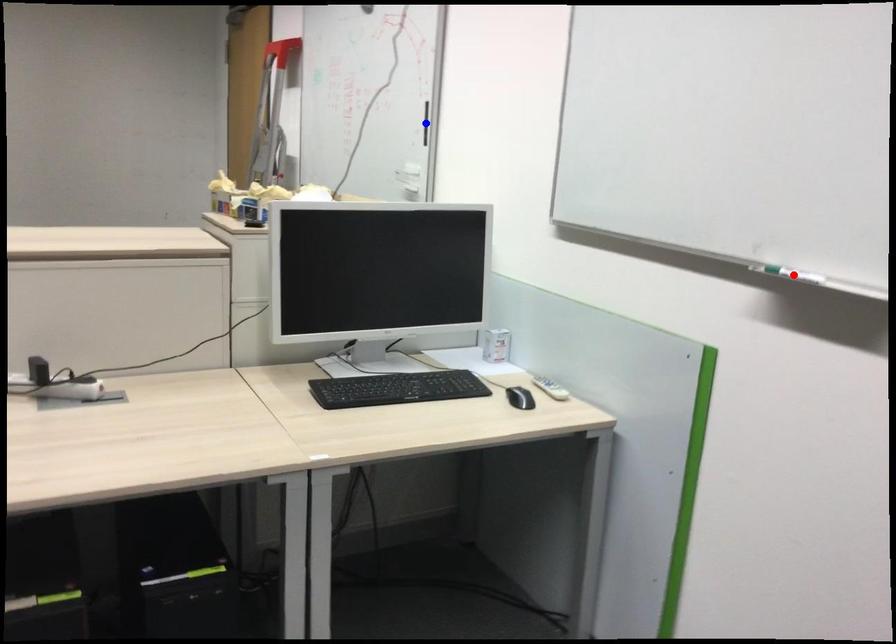
Question: Two points are marked on the image. Which point is closer to the camera?

Choices:
 (A) Blue point is closer.
 (B) Red point is closer.

Answer: (B)